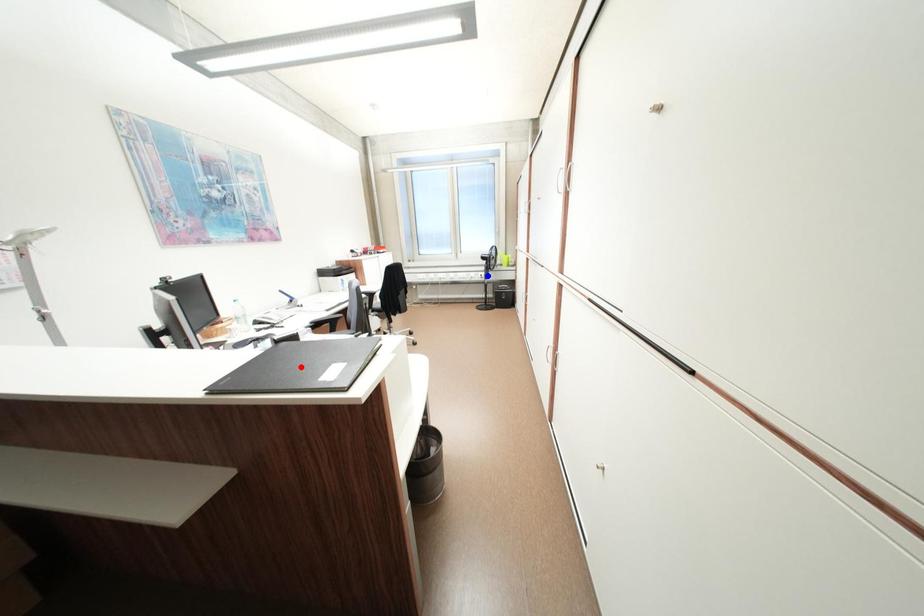
Question: Which of the two points in the image is closer to the camera?

Choices:
 (A) Blue point is closer.
 (B) Red point is closer.

Answer: (B)